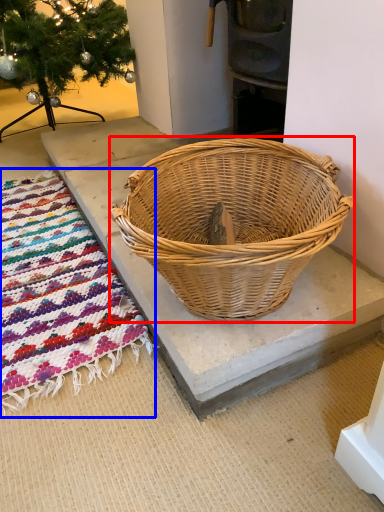
Question: Which object appears closest to the camera in this image, picnic basket (highlighted by a red box) or mat (highlighted by a blue box)?

Choices:
 (A) picnic basket
 (B) mat

Answer: (A)